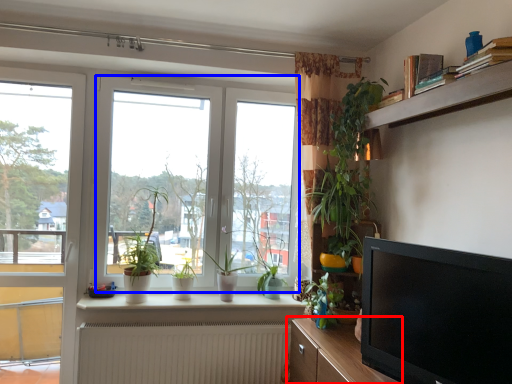
Question: Which object is closer to the camera taking this photo, cabinetry (highlighted by a red box) or window (highlighted by a blue box)?

Choices:
 (A) cabinetry
 (B) window

Answer: (A)